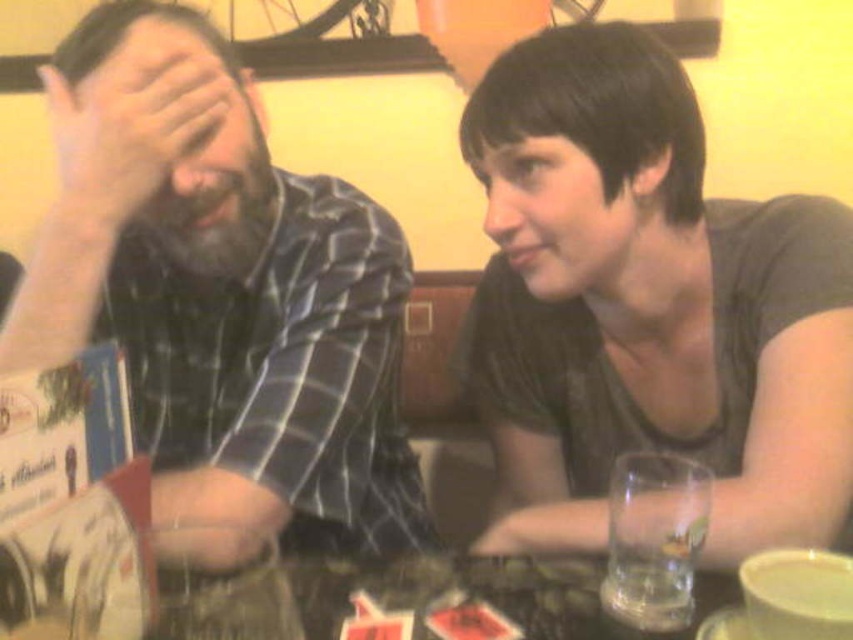
You are standing at the point with coordinates point (167, 148) and want to move to the point with coordinates point (808, 388). Can you walk directly to your destination without going around any obstacles?

Point (808, 388) is behind point (167, 148), so you cannot walk directly to your destination without going around any obstacles.

You are a waiter in a restaurant and need to place a new drink on the table without touching the existing items. The table has a matte skin hand at center and a yellow matte cup at lower right. Which object should you avoid placing the drink near to ensure it doesn t get knocked over?

You should avoid placing the drink near the matte skin hand at center because it is closer to you than the yellow matte cup at lower right, making it more likely to be in the way of movements.

You are a waiter at a restaurant and need to place a new order of a small plate between the yellow matte cup at lower right and the clear glass at lower right. The plate is 3 inches in diameter. Can you fit it between them without moving the cup or glass?

The distance between the yellow matte cup at lower right and the clear glass at lower right is 3.42 inches. Since the plate is 3 inches in diameter, it can fit between them as the space is slightly larger than the plate.